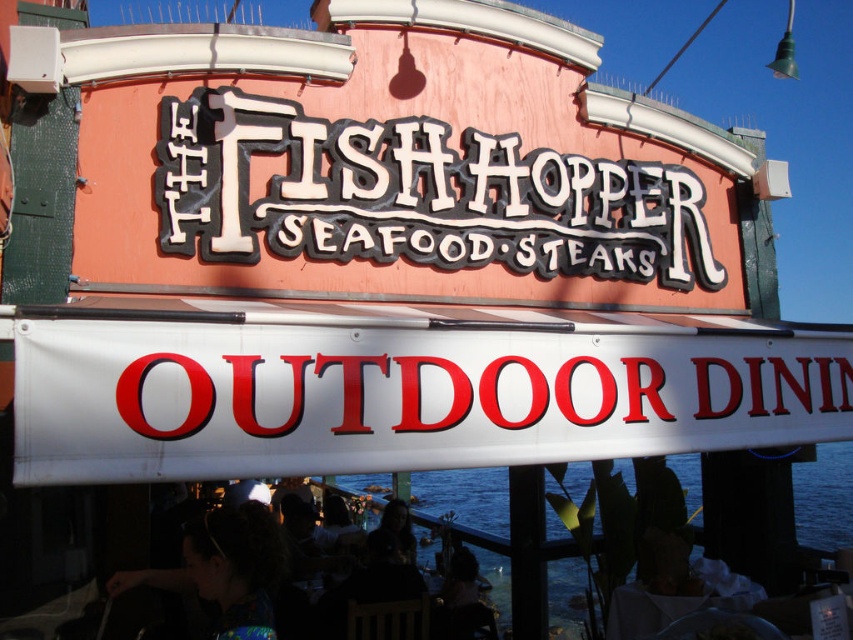
Question: Which point is farther to the camera?

Choices:
 (A) white glossy signboard at center
 (B) transparent water at lower center

Answer: (B)

Question: Is white plastic sign at lower center above white glossy signboard at center?

Choices:
 (A) yes
 (B) no

Answer: (B)

Question: Which point is farther to the camera?

Choices:
 (A) (370, 237)
 (B) (120, 388)
 (C) (834, 538)
 (D) (316, 412)

Answer: (C)

Question: In this image, where is black plastic sign at center located relative to white glossy signboard at center?

Choices:
 (A) left
 (B) right

Answer: (A)

Question: Observing the image, what is the correct spatial positioning of black plastic sign at center in reference to white glossy signboard at center?

Choices:
 (A) right
 (B) left

Answer: (B)

Question: Which point is closer to the camera?

Choices:
 (A) transparent water at lower center
 (B) black plastic sign at center
 (C) white plastic sign at lower center

Answer: (A)